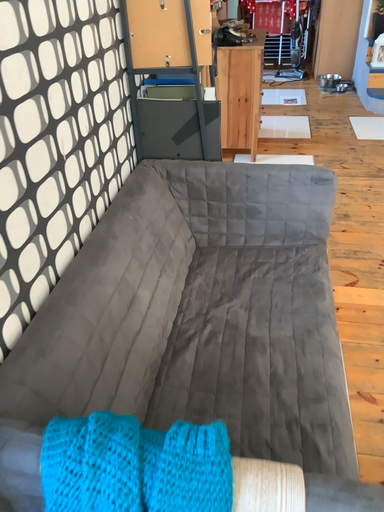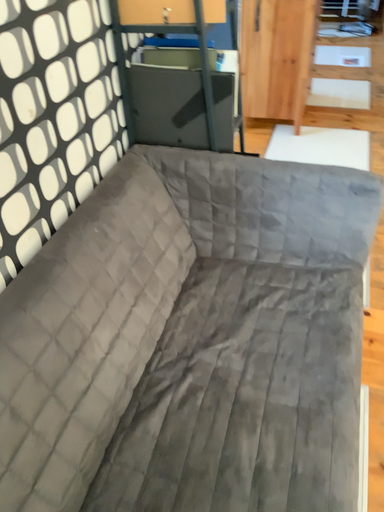
Question: How did the camera likely rotate when shooting the video?

Choices:
 (A) rotated right
 (B) rotated left

Answer: (B)